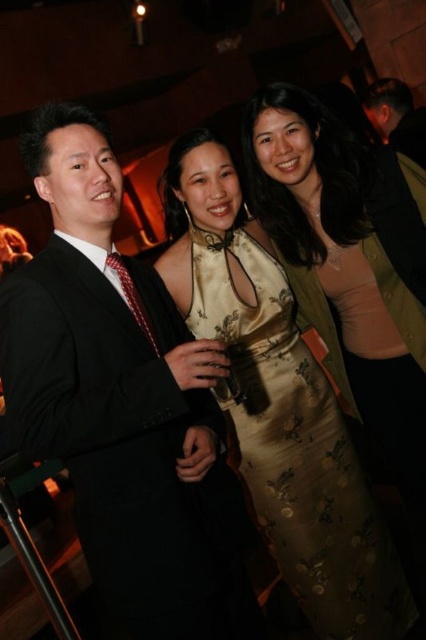
Consider the image. You are a photographer at the event and need to adjust the lighting to ensure both the silky gold dress at center and the black suit at upper right are well illuminated. Based on their positions, which one is closer to the light source located at the upper left corner of the room?

The black suit at upper right is closer to the light source at the upper left corner of the room because it is positioned above the silky gold dress at center.

You are a photographer adjusting your camera settings to capture the group photo. Since the silky gold dress at center and the black suit at upper right are in the frame, which one will appear larger in your photo?

The silky gold dress at center will appear larger in the photo because it is closer to the viewer than the black suit at upper right.